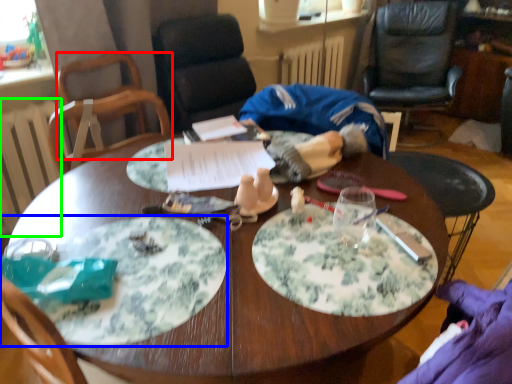
Question: Which is farther away from chair (highlighted by a red box)? plate (highlighted by a blue box) or radiator (highlighted by a green box)?

Choices:
 (A) plate
 (B) radiator

Answer: (A)